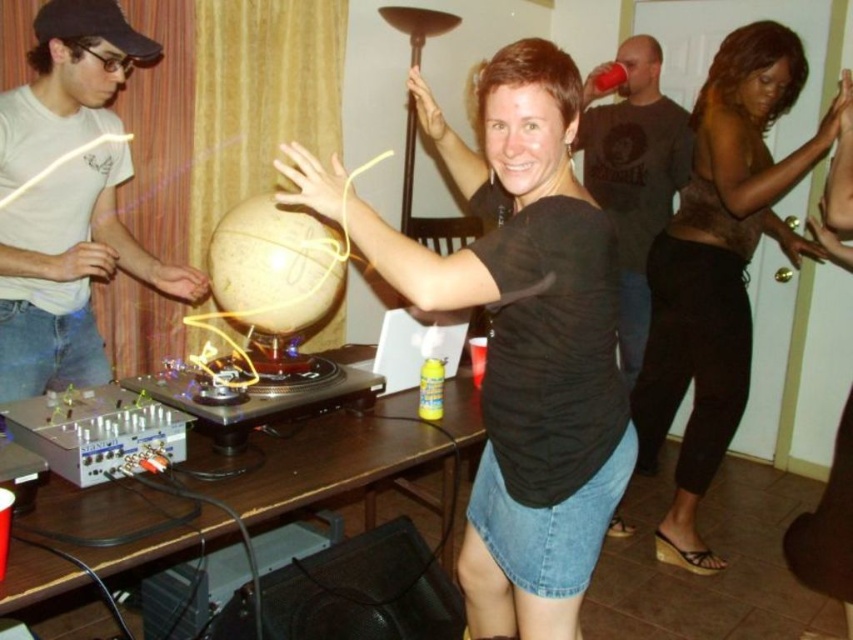
You are a photographer at the party and need to capture both the black matte shirt at center and the brown sheer top at upper right in a single frame. Which object should you focus on first to ensure both are in the frame?

Since the black matte shirt at center is smaller than the brown sheer top at upper right, you should focus on the brown sheer top at upper right first to ensure both are included in the frame.